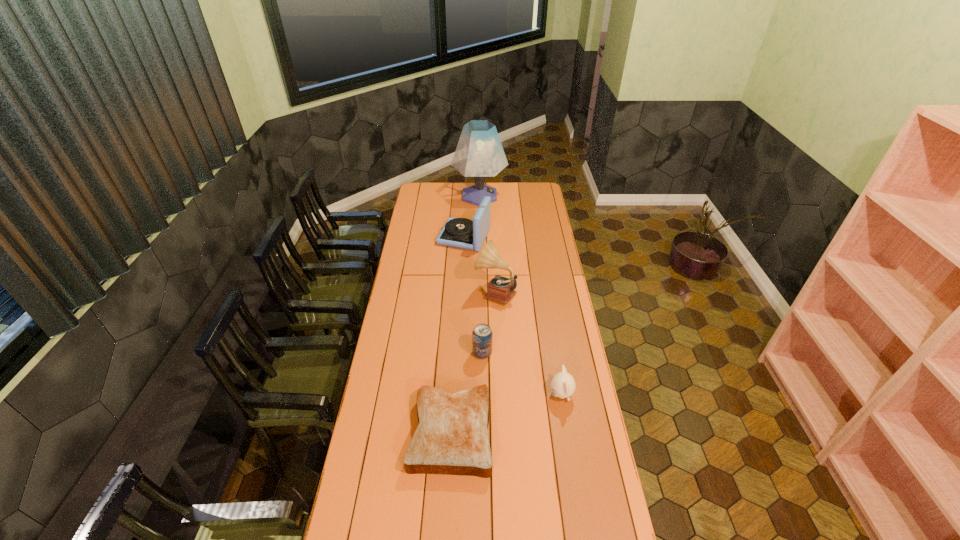
This screenshot has width=960, height=540. Find the location of `object that stands as the second closest to the third farthest object`. object that stands as the second closest to the third farthest object is located at coordinates (482, 335).

At what (x,y) coordinates should I click in order to perform the action: click on the third closest object to the shortest object. Please return your answer as a coordinate pair (x, y). The width and height of the screenshot is (960, 540). Looking at the image, I should click on (500, 289).

Where is `free spot that satisfies the following two spatial constraints: 1. on the face of the kitten; 2. on the front side of the shortest object`? The height and width of the screenshot is (540, 960). free spot that satisfies the following two spatial constraints: 1. on the face of the kitten; 2. on the front side of the shortest object is located at coordinates (567, 433).